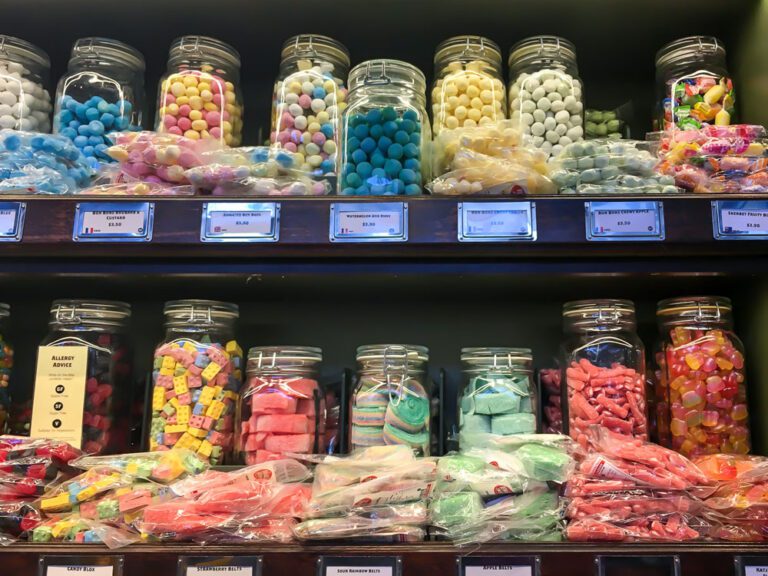
Identify the location of shelf. 306,234, 441,545.